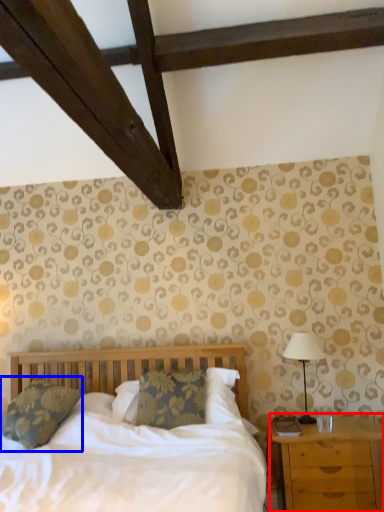
Question: Which of the following is the farthest to the observer, nightstand (highlighted by a red box) or pillow (highlighted by a blue box)?

Choices:
 (A) nightstand
 (B) pillow

Answer: (B)